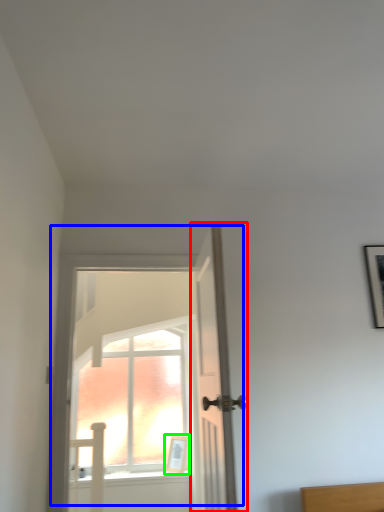
Question: Which object is the farthest from door (highlighted by a red box)? Choose among these: door (highlighted by a blue box) or picture frame (highlighted by a green box).

Choices:
 (A) door
 (B) picture frame

Answer: (A)